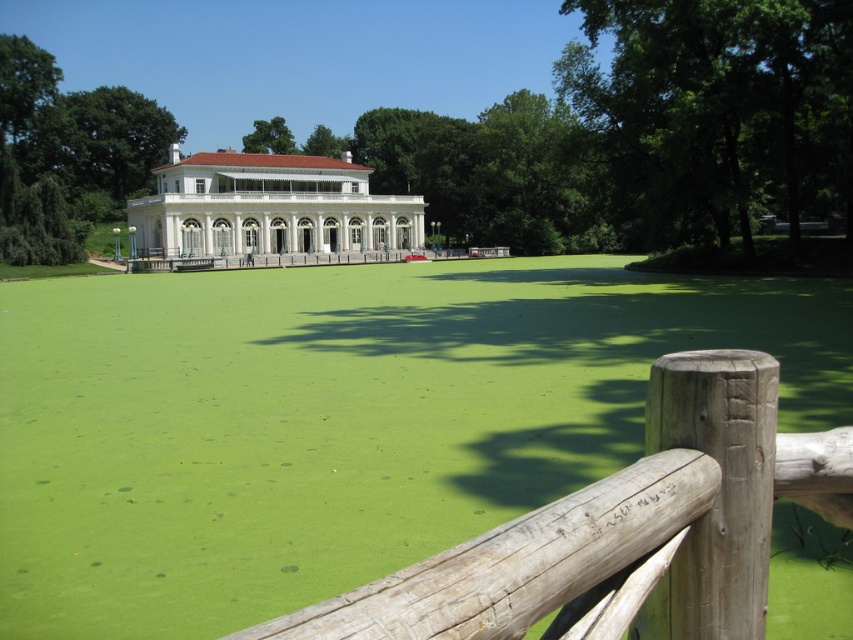
How distant is weathered wood fence at lower center from wooden at center?

weathered wood fence at lower center and wooden at center are 73.29 meters apart.

Who is positioned more to the left, weathered wood fence at lower center or wooden at center?

From the viewer's perspective, wooden at center appears more on the left side.

Is point (711, 368) behind point (128, 262)?

No, (711, 368) is closer to viewer.

This screenshot has width=853, height=640. What are the coordinates of `weathered wood fence at lower center` in the screenshot? It's located at (624, 531).